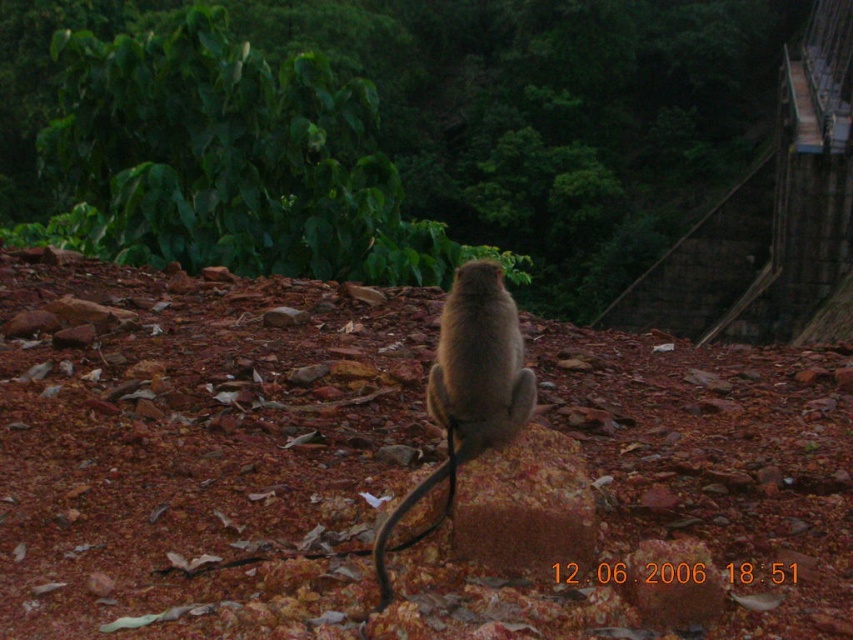
Question: Can you confirm if green leafy tree at upper center is bigger than furry brown monkey at center?

Choices:
 (A) no
 (B) yes

Answer: (B)

Question: Does green leafy tree at upper center appear on the left side of furry brown monkey at center?

Choices:
 (A) yes
 (B) no

Answer: (B)

Question: Which point is farther to the camera?

Choices:
 (A) (44, 24)
 (B) (476, 401)

Answer: (A)

Question: In this image, where is green leafy tree at upper center located relative to furry brown monkey at center?

Choices:
 (A) below
 (B) above

Answer: (B)

Question: Which of the following is the closest to the observer?

Choices:
 (A) green leafy tree at upper center
 (B) furry brown monkey at center

Answer: (B)